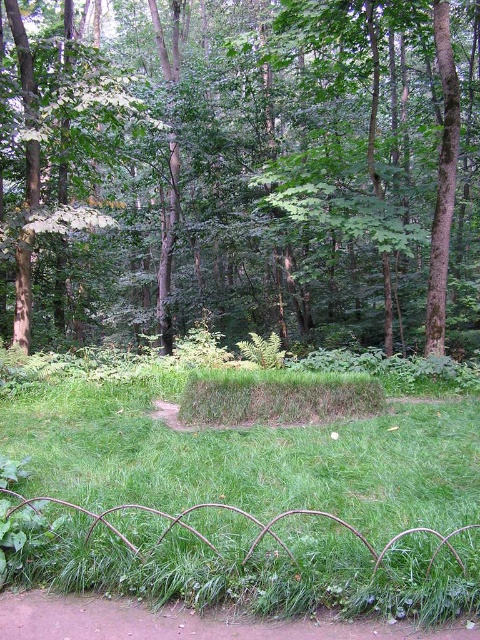
Question: Can you confirm if green grassy mound at center is positioned below brown dirt path at lower left?

Choices:
 (A) yes
 (B) no

Answer: (B)

Question: Can you confirm if green leafy tree at center is positioned to the right of brown dirt path at lower left?

Choices:
 (A) no
 (B) yes

Answer: (B)

Question: Which point is farther to the camera?

Choices:
 (A) (157, 100)
 (B) (263, 620)
 (C) (45, 486)

Answer: (A)

Question: Which point is closer to the camera?

Choices:
 (A) green leafy tree at center
 (B) brown dirt path at lower left

Answer: (B)

Question: Can you confirm if green grassy mound at center is positioned to the left of brown dirt path at lower left?

Choices:
 (A) yes
 (B) no

Answer: (A)

Question: Estimate the real-world distances between objects in this image. Which object is farther from the green leafy tree at center?

Choices:
 (A) green grassy mound at center
 (B) brown dirt path at lower left

Answer: (B)